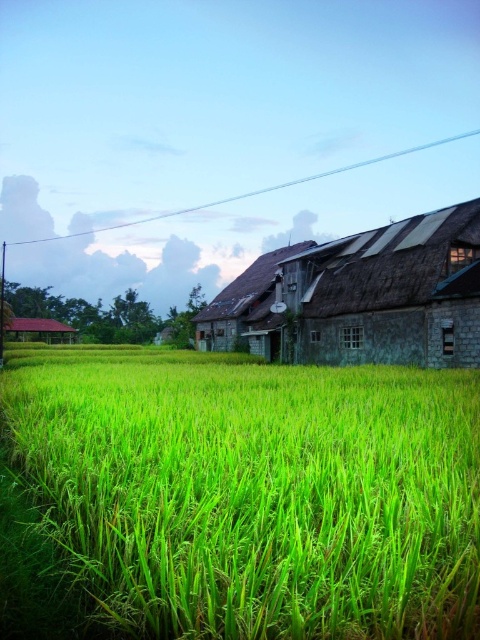
You are standing in the rural landscape and want to take a photo of both point (x=215, y=604) and point (x=463, y=339). Which point should you focus on first to ensure both are in clear view?

You should focus on point (x=215, y=604) first because it is closer to the camera, ensuring both points are in focus when using a shallow depth of field.

You are a farmer checking the height of your crops. You have a green grassy field at center and a rusty corrugated metal barn at center in your view. Which one is shorter?

The green grassy field at center is shorter than the rusty corrugated metal barn at center.

You are a farmer who wants to move a tractor from the green grassy field at center to the rusty corrugated metal barn at center. Which direction should you drive the tractor to reach the barn?

The green grassy field at center is positioned on the left side of the rusty corrugated metal barn at center, so you should drive the tractor to the right to reach the barn.